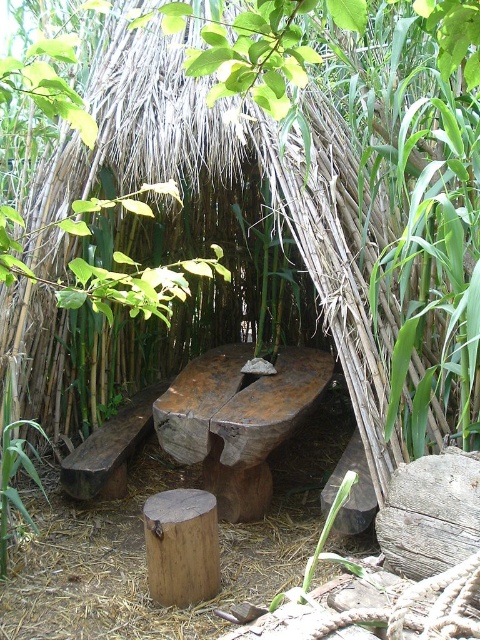
Does point (20, 449) lie behind point (358, 570)?

That is True.

Can you confirm if green leafy plant at lower left is wider than green leafy plant at lower center?

No, green leafy plant at lower left is not wider than green leafy plant at lower center.

Between point (14, 488) and point (316, 563), which one is positioned behind?

The point (14, 488) is behind.

Where is `green leafy plant at lower left`? This screenshot has width=480, height=640. green leafy plant at lower left is located at coordinates (13, 472).